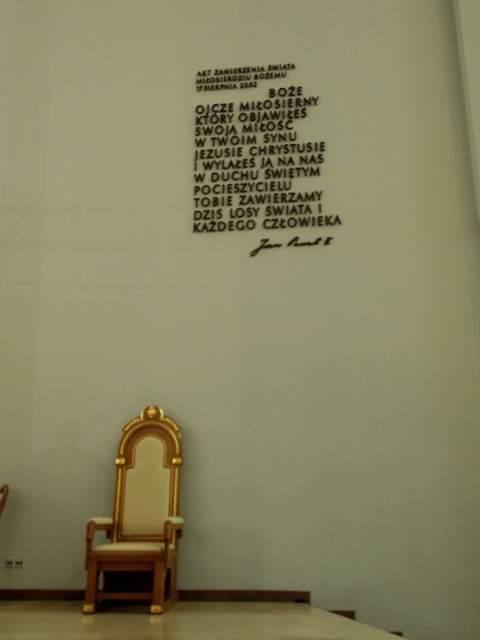
Which is more to the right, black paper at upper center or gold wood throne at center?

black paper at upper center

Is the position of black paper at upper center less distant than that of gold wood throne at center?

No, it is behind gold wood throne at center.

Between point (274, 224) and point (179, 522), which one is positioned behind?

Point (274, 224)

This screenshot has width=480, height=640. I want to click on black paper at upper center, so click(x=257, y=161).

In the scene shown: Does black paper at upper center appear on the left side of wooden polished chair at lower left?

Incorrect, black paper at upper center is not on the left side of wooden polished chair at lower left.

Does black paper at upper center appear over wooden polished chair at lower left?

Correct, black paper at upper center is located above wooden polished chair at lower left.

You are a GUI agent. You are given a task and a screenshot of the screen. Output one action in this format:
    pyautogui.click(x=<x>, y=<y>)
    Task: Click on the black paper at upper center
    The image size is (480, 640).
    Given the screenshot: What is the action you would take?
    pyautogui.click(x=257, y=161)

Is gold wood throne at center to the right of wooden polished chair at lower left from the viewer's perspective?

Correct, you'll find gold wood throne at center to the right of wooden polished chair at lower left.

Find the location of a particular element. The height and width of the screenshot is (640, 480). gold wood throne at center is located at coordinates (140, 518).